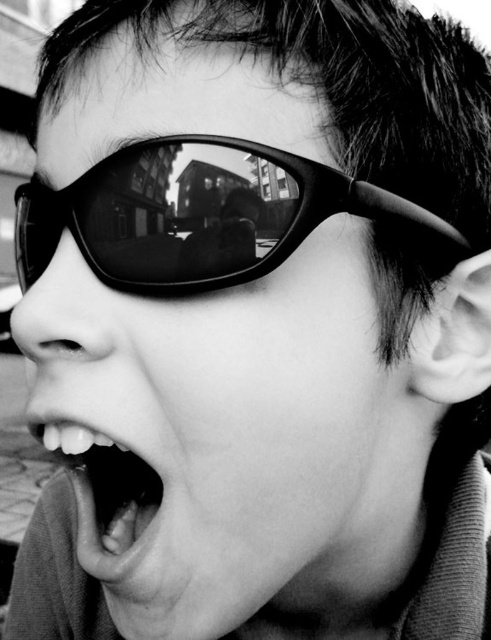
Can you confirm if black matte sunglasses at upper center is taller than smooth white teeth at center?

No, black matte sunglasses at upper center is not taller than smooth white teeth at center.

Between point (97, 205) and point (94, 524), which one is positioned in front?

Positioned in front is point (97, 205).

Locate an element on the screen. This screenshot has width=491, height=640. black matte sunglasses at upper center is located at coordinates (207, 216).